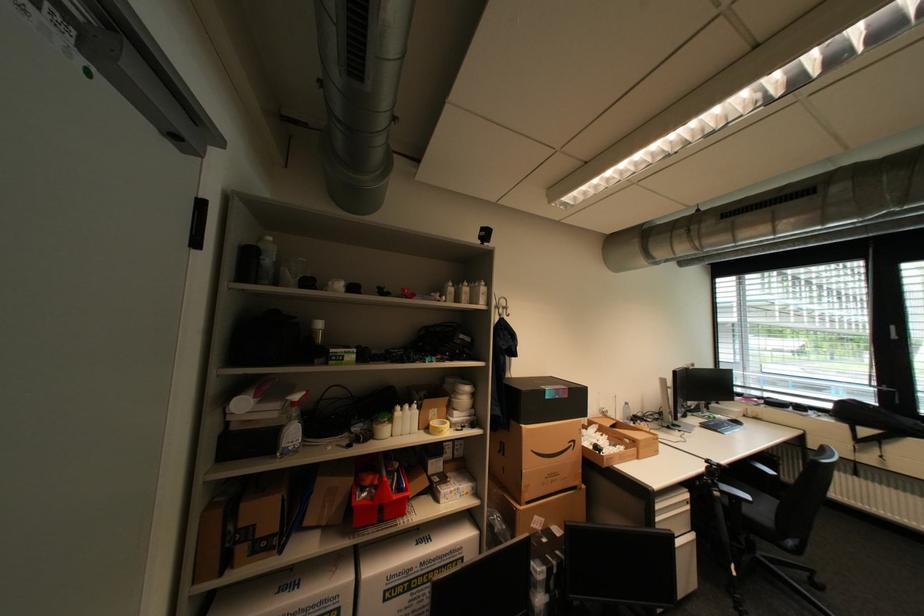
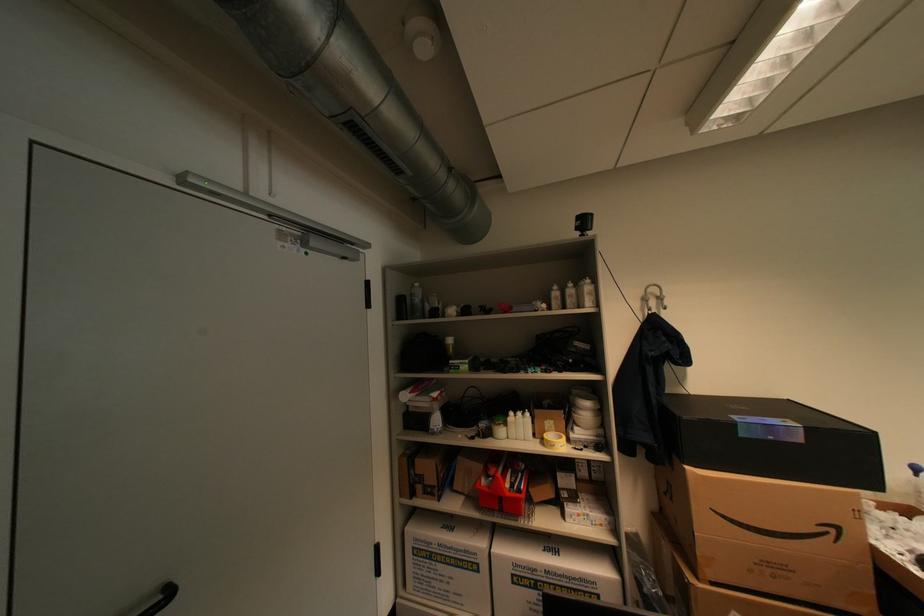
Where in the second image is the point corresponding to pixel 488 238 from the first image?

(586, 230)